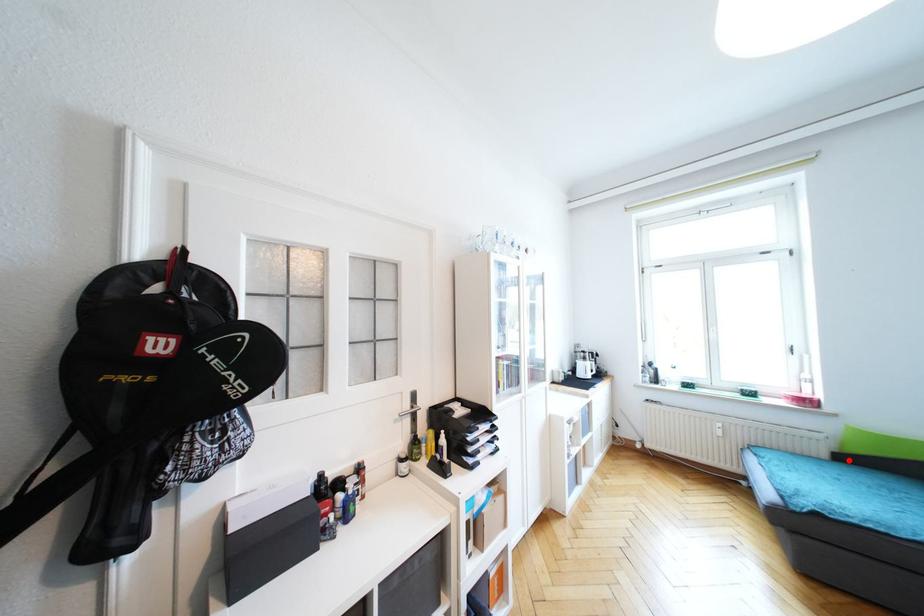
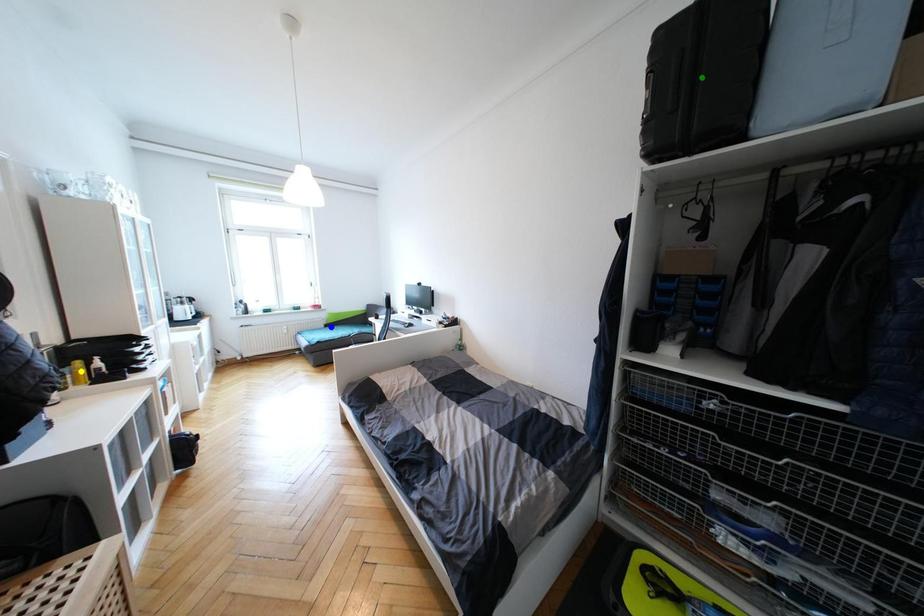
Question: I am providing you with two images of the same scene from different viewpoints. A red point is marked on the first image. You are given multiple points on the second image. Which spot in image 2 lines up with the point in image 1?

Choices:
 (A) green point
 (B) blue point
 (C) yellow point

Answer: (B)